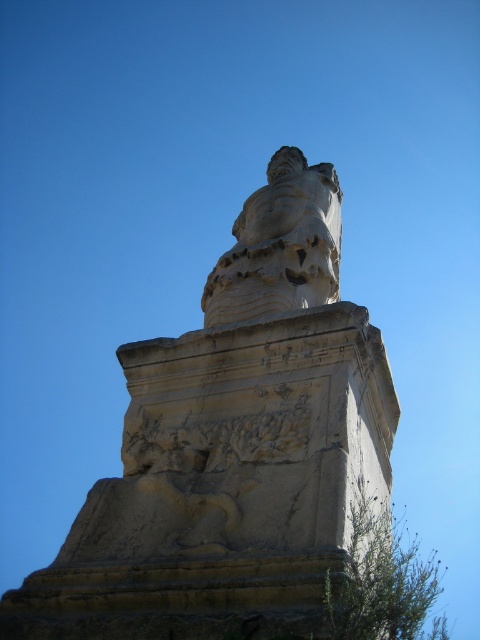
Is the position of white stone statue at center less distant than that of white marble bust at center?

Yes, it is in front of white marble bust at center.

Which is more to the right, white stone statue at center or white marble bust at center?

Positioned to the right is white marble bust at center.

Who is more distant from viewer, (305, 289) or (312, 216)?

Positioned behind is point (312, 216).

You are a GUI agent. You are given a task and a screenshot of the screen. Output one action in this format:
    pyautogui.click(x=<x>, y=<y>)
    Task: Click on the white stone statue at center
    
    Given the screenshot: What is the action you would take?
    pyautogui.click(x=233, y=445)